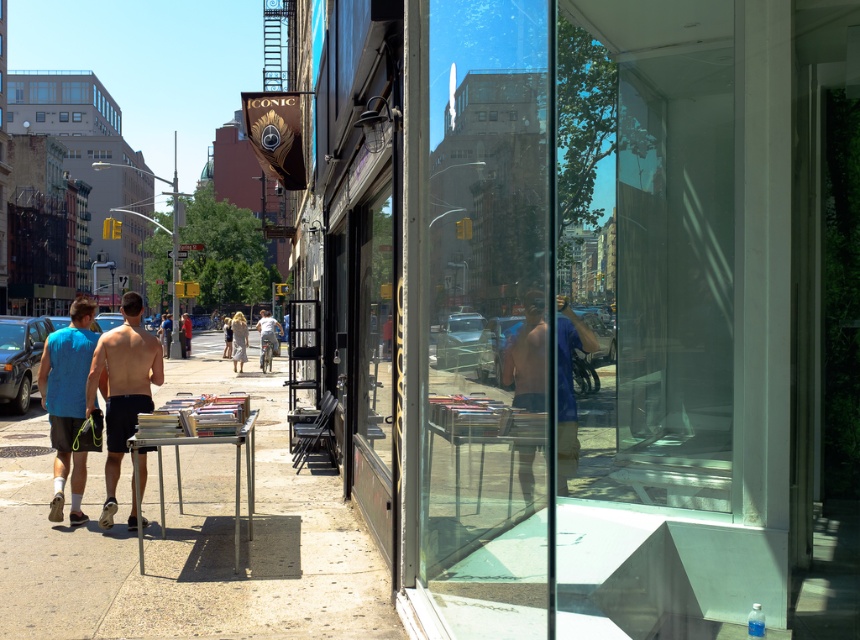
You are standing on the sidewalk and want to find the blue sleeveless shirt at left. Based on the coordinates given, can you estimate its position relative to the center of the image?

The blue sleeveless shirt at left is located at coordinates point (68, 403). Since the center of the image is at point (430, 320), this position is to the right and above the center.